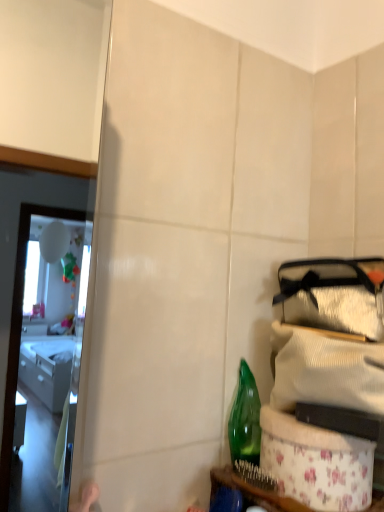
Question: From a real-world perspective, is green glass bottle at lower right physically located above or below floral fabric basket at lower right?

Choices:
 (A) below
 (B) above

Answer: (B)

Question: In terms of height, does green glass bottle at lower right look taller or shorter compared to floral fabric basket at lower right?

Choices:
 (A) short
 (B) tall

Answer: (B)

Question: Is point (243, 410) closer or farther from the camera than point (220, 485)?

Choices:
 (A) closer
 (B) farther

Answer: (B)

Question: Relative to green glass bottle at lower right, is floral fabric basket at lower right in front or behind?

Choices:
 (A) behind
 (B) front

Answer: (B)

Question: Considering the positions of floral fabric basket at lower right and green glass bottle at lower right in the image, is floral fabric basket at lower right wider or thinner than green glass bottle at lower right?

Choices:
 (A) thin
 (B) wide

Answer: (B)

Question: Which is correct: floral fabric basket at lower right is inside green glass bottle at lower right, or outside of it?

Choices:
 (A) outside
 (B) inside

Answer: (A)

Question: In terms of height, does floral fabric basket at lower right look taller or shorter compared to green glass bottle at lower right?

Choices:
 (A) short
 (B) tall

Answer: (A)